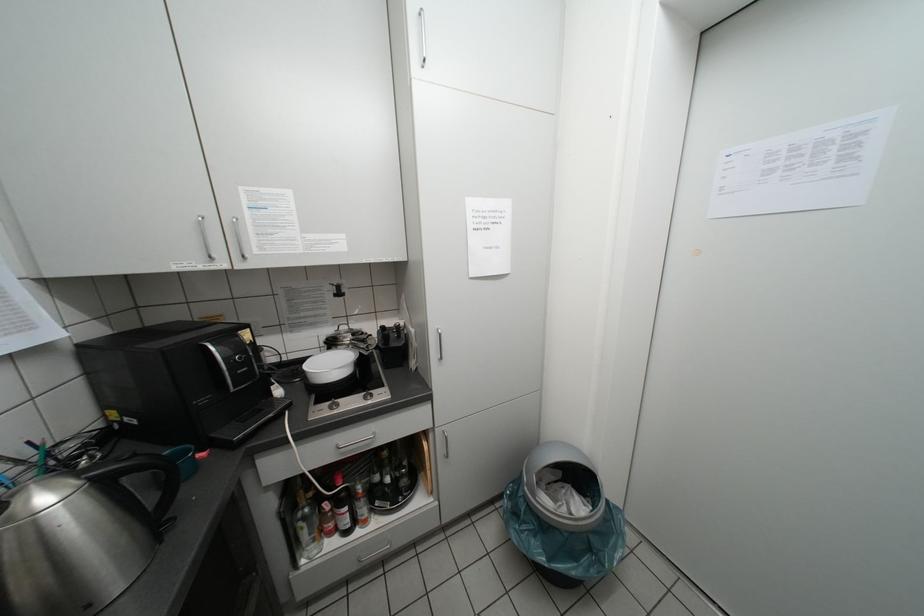
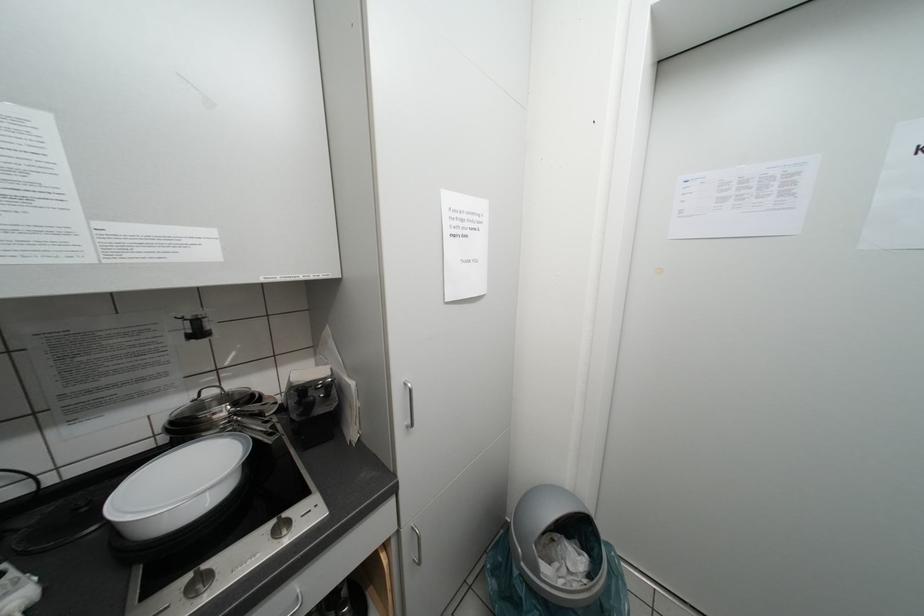
What movement of the cameraman would produce the second image?

The cameraman walked toward left, forward.